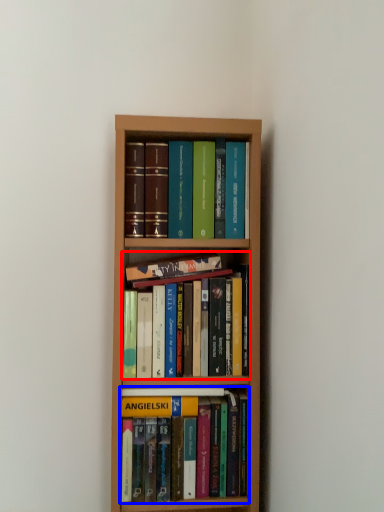
Question: Which of the following is the farthest to the observer, book (highlighted by a red box) or book (highlighted by a blue box)?

Choices:
 (A) book
 (B) book

Answer: (B)